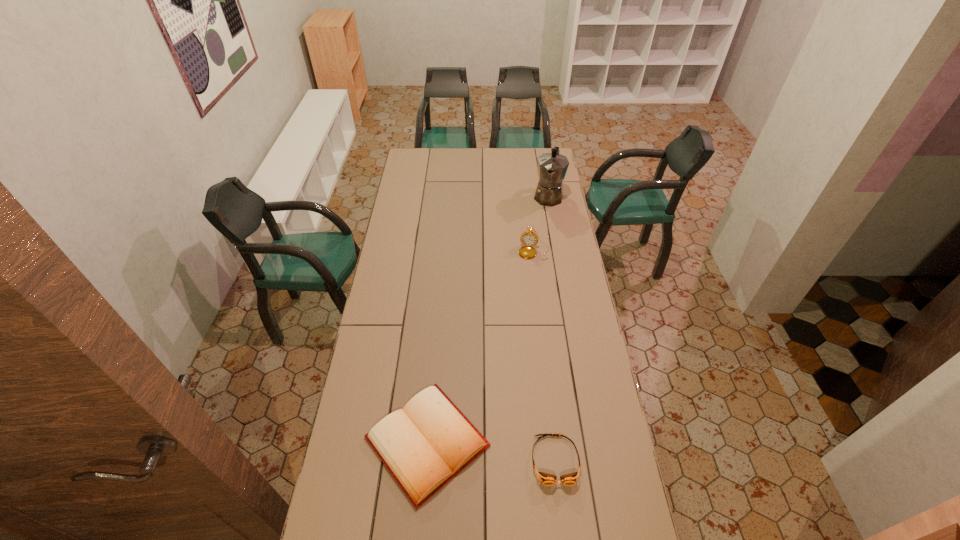
The height and width of the screenshot is (540, 960). In order to click on Bible in this screenshot , I will do `click(424, 445)`.

Where is `goggles`? Image resolution: width=960 pixels, height=540 pixels. goggles is located at coordinates (546, 479).

At what (x,y) coordinates should I click in order to perform the action: click on coffeepot. Please return your answer as a coordinate pair (x, y). This screenshot has width=960, height=540. Looking at the image, I should click on (552, 167).

The image size is (960, 540). I want to click on the farthest object, so click(x=552, y=167).

This screenshot has width=960, height=540. What are the coordinates of `the second farthest object` in the screenshot? It's located at pyautogui.click(x=528, y=238).

At what (x,y) coordinates should I click in order to perform the action: click on the second tallest object. Please return your answer as a coordinate pair (x, y). The image size is (960, 540). Looking at the image, I should click on (528, 238).

Where is `free space located 0.100m on the back of the leftmost object`? Image resolution: width=960 pixels, height=540 pixels. free space located 0.100m on the back of the leftmost object is located at coordinates (434, 362).

The image size is (960, 540). I want to click on vacant region located 0.080m with the lenses facing forward on the goggles, so click(562, 515).

I want to click on free region located 0.150m on the pouring side of the farthest object, so click(x=541, y=227).

Find the location of a particular element. Image resolution: width=960 pixels, height=540 pixels. free space located on the pouring side of the farthest object is located at coordinates (544, 218).